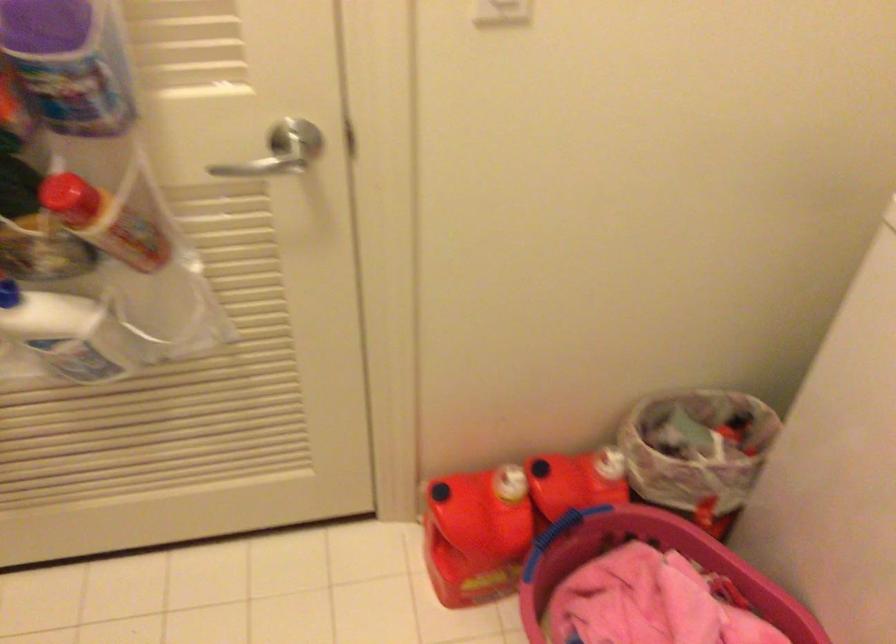
Describe the element at coordinates (651, 603) in the screenshot. The image size is (896, 644). I see `the laundry basket handle` at that location.